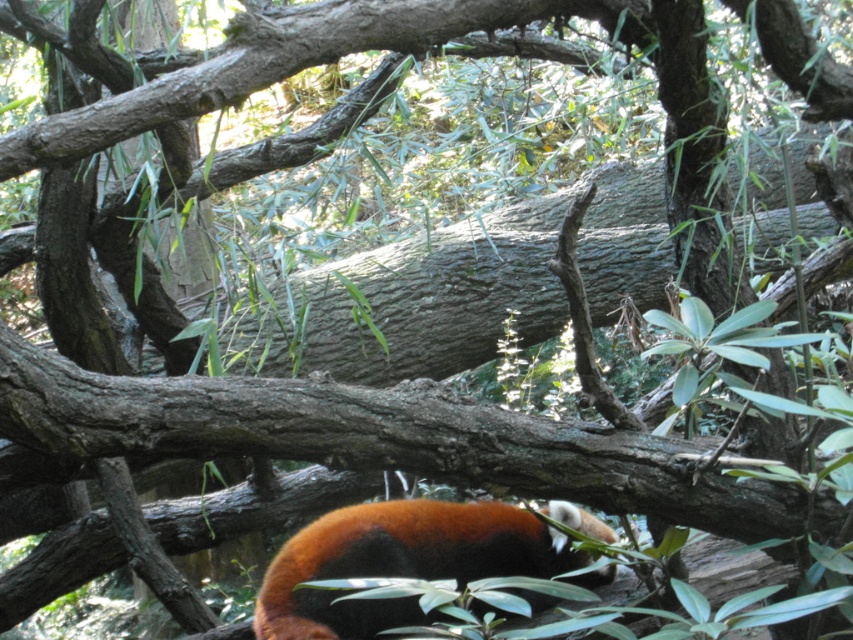
Looking at this image, does gray textured log at center have a lesser width compared to fluffy orange-red fur at lower center?

Incorrect, gray textured log at center's width is not less than fluffy orange-red fur at lower center's.

Can you confirm if gray textured log at center is shorter than fluffy orange-red fur at lower center?

No.

Between point (376, 259) and point (375, 532), which one is positioned in front?

Point (375, 532) is more forward.

You are a GUI agent. You are given a task and a screenshot of the screen. Output one action in this format:
    pyautogui.click(x=<x>, y=<y>)
    Task: Click on the gray textured log at center
    Image resolution: width=853 pixels, height=640 pixels.
    Given the screenshot: What is the action you would take?
    pyautogui.click(x=410, y=301)